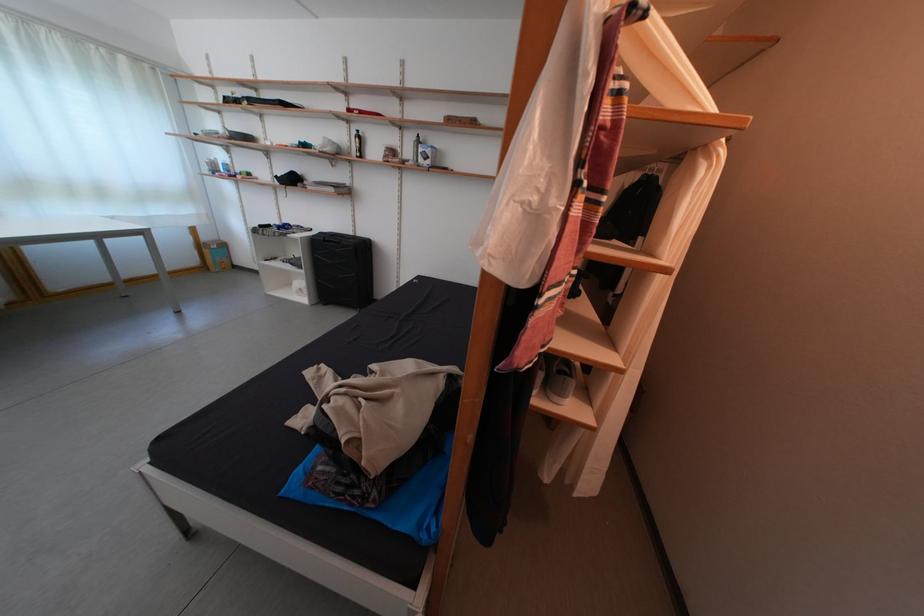
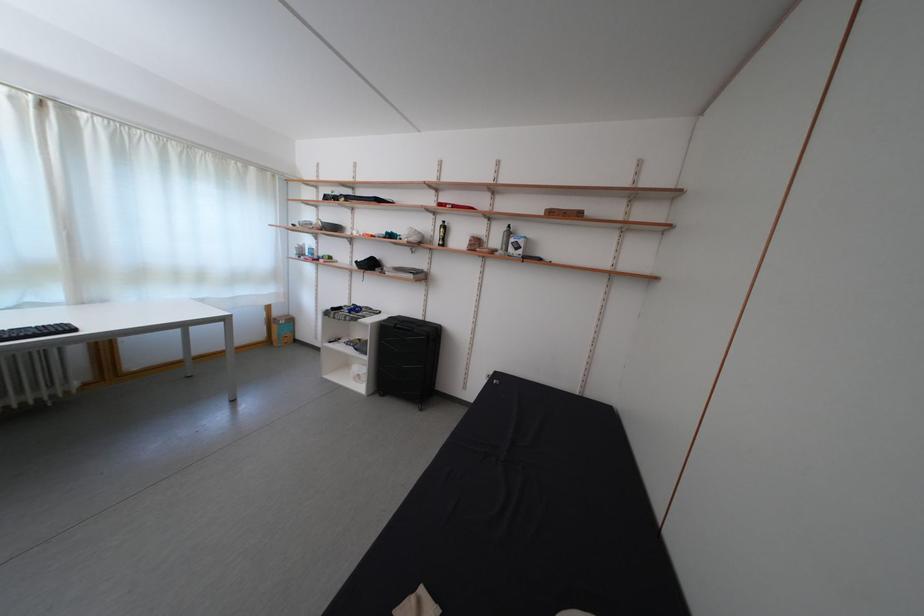
Locate, in the second image, the point that corresponds to pixel 331 238 in the first image.

(399, 323)